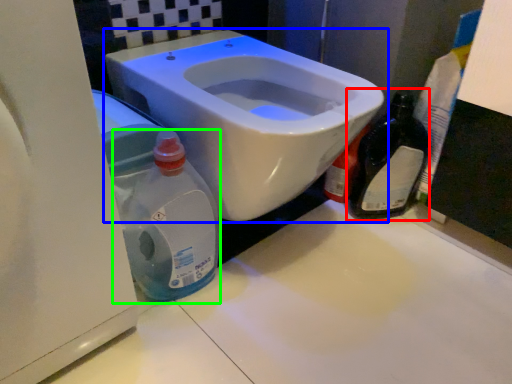
Question: Considering the real-world distances, which object is farthest from bottle (highlighted by a red box)? toilet (highlighted by a blue box) or cleaning product (highlighted by a green box)?

Choices:
 (A) toilet
 (B) cleaning product

Answer: (B)